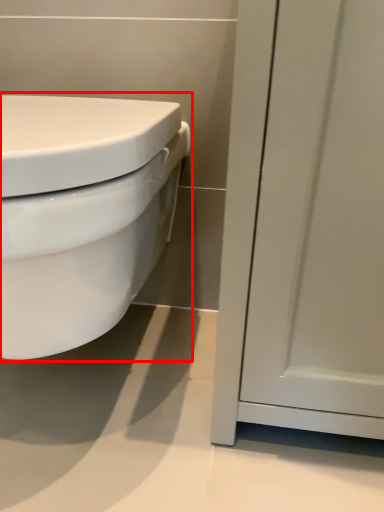
Question: From the image's perspective, what is the correct spatial positioning of toilet (annotated by the red box) in reference to screen door?

Choices:
 (A) below
 (B) above

Answer: (A)